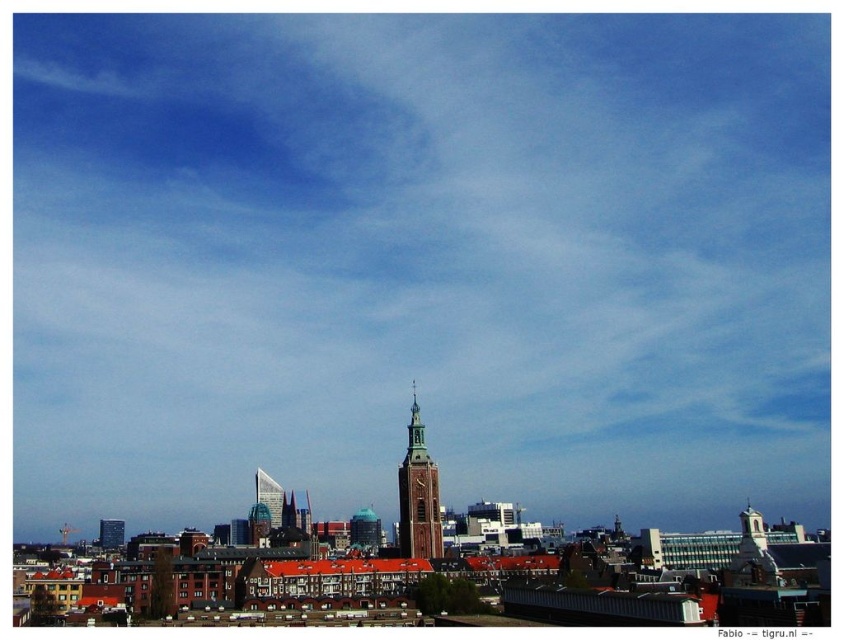
Is brown brick bell tower at center thinner than glassy steel skyscraper at center?

Yes, brown brick bell tower at center is thinner than glassy steel skyscraper at center.

Does brown brick bell tower at center appear under glassy steel skyscraper at center?

Actually, brown brick bell tower at center is above glassy steel skyscraper at center.

At what (x,y) coordinates should I click in order to perform the action: click on brown brick bell tower at center. Please return your answer as a coordinate pair (x, y). Looking at the image, I should click on (418, 493).

This screenshot has width=844, height=640. Find the location of `brown brick bell tower at center`. brown brick bell tower at center is located at coordinates coord(418,493).